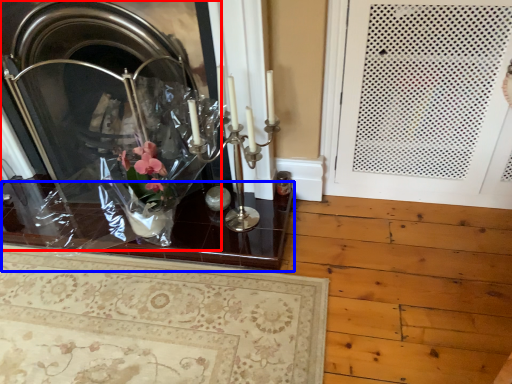
Question: Which object appears farthest to the camera in this image, fireplace (highlighted by a red box) or table (highlighted by a blue box)?

Choices:
 (A) fireplace
 (B) table

Answer: (B)